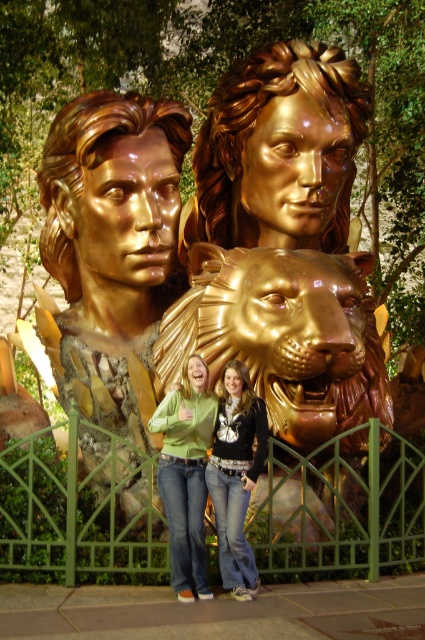
Is point (269, 97) positioned before point (308, 353)?

No, it is behind (308, 353).

Is gold polished statue at center taller than gold shiny lion at center?

Yes, gold polished statue at center is taller than gold shiny lion at center.

Which is behind, point (249, 314) or point (243, 300)?

Positioned behind is point (243, 300).

Find the location of a particular element. gold polished statue at center is located at coordinates (231, 259).

Is gold shiny lion at center to the left of jeans at center from the viewer's perspective?

No, gold shiny lion at center is not to the left of jeans at center.

Consider the image. Is gold shiny lion at center to the right of jeans at center from the viewer's perspective?

Correct, you'll find gold shiny lion at center to the right of jeans at center.

In the scene shown: Who is more distant from viewer, (283, 275) or (218, 428)?

The point (283, 275) is behind.

Locate an element on the screen. The width and height of the screenshot is (425, 640). gold shiny lion at center is located at coordinates (283, 336).

Find the location of `shiny gold bust at center`. shiny gold bust at center is located at coordinates (112, 250).

Looking at this image, does shiny gold bust at center appear on the left side of gold shiny lion at center?

Indeed, shiny gold bust at center is positioned on the left side of gold shiny lion at center.

Describe the element at coordinates (112, 250) in the screenshot. Image resolution: width=425 pixels, height=640 pixels. I see `shiny gold bust at center` at that location.

Where is `shiny gold bust at center`? shiny gold bust at center is located at coordinates (112, 250).